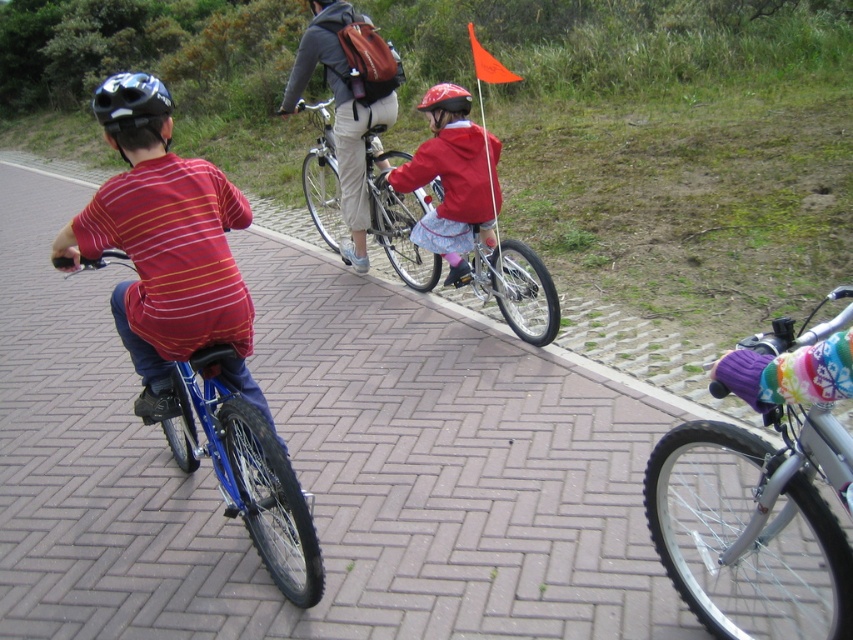
You are a pedestrian trying to cross the path. You see the matte red jacket at center and the orange fabric flag at upper center. Which object is wider?

The orange fabric flag at upper center is wider than the matte red jacket at center.

You are a delivery drone flying above the scene. You need to drop a package at the exact location of the matte red jacket at center. According to the coordinates provided, where should you aim the package?

The matte red jacket at center is located at coordinates point (453, 179), so you should aim the package at point (453, 179).